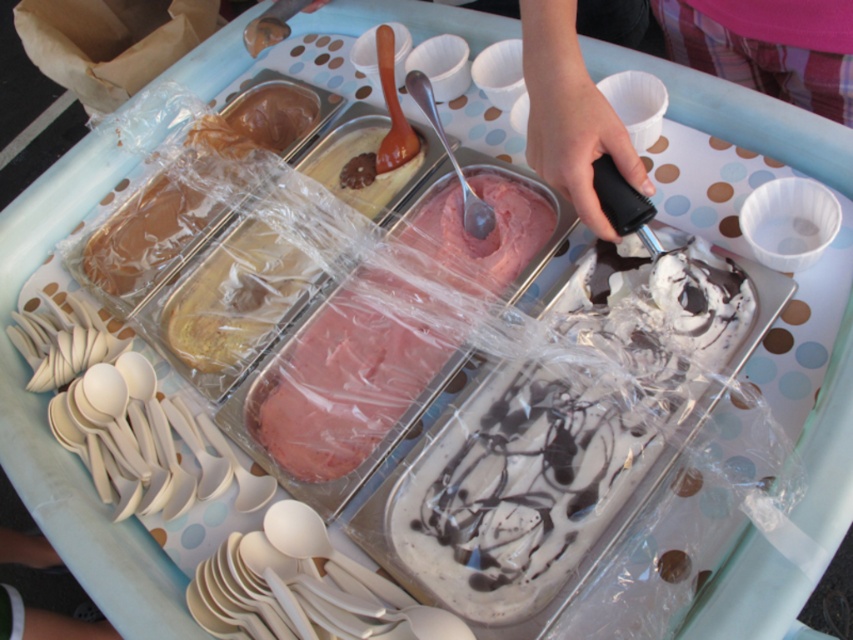
Is white chocolate ice cream at center shorter than pink creamy ice cream at center?

Indeed, white chocolate ice cream at center has a lesser height compared to pink creamy ice cream at center.

Can you confirm if white chocolate ice cream at center is bigger than pink creamy ice cream at center?

No.

Which is behind, point (567, 532) or point (259, 416)?

Point (259, 416)

You are a GUI agent. You are given a task and a screenshot of the screen. Output one action in this format:
    pyautogui.click(x=<x>, y=<y>)
    Task: Click on the white chocolate ice cream at center
    The image size is (853, 640).
    Given the screenshot: What is the action you would take?
    pyautogui.click(x=561, y=440)

Can you confirm if yellow matte ice cream at center is wider than smooth chocolate ice cream at left?

In fact, yellow matte ice cream at center might be narrower than smooth chocolate ice cream at left.

Which of these two, yellow matte ice cream at center or smooth chocolate ice cream at left, stands taller?

smooth chocolate ice cream at left is taller.

What do you see at coordinates (238, 298) in the screenshot?
I see `yellow matte ice cream at center` at bounding box center [238, 298].

Find the location of a particular element. Image resolution: width=853 pixels, height=640 pixels. yellow matte ice cream at center is located at coordinates (238, 298).

Which of these two, white chocolate ice cream at center or smooth black ice cream scoop at center, stands shorter?

smooth black ice cream scoop at center is shorter.

Can you confirm if white chocolate ice cream at center is thinner than smooth black ice cream scoop at center?

No.

You are a GUI agent. You are given a task and a screenshot of the screen. Output one action in this format:
    pyautogui.click(x=<x>, y=<y>)
    Task: Click on the white chocolate ice cream at center
    
    Given the screenshot: What is the action you would take?
    pyautogui.click(x=561, y=440)